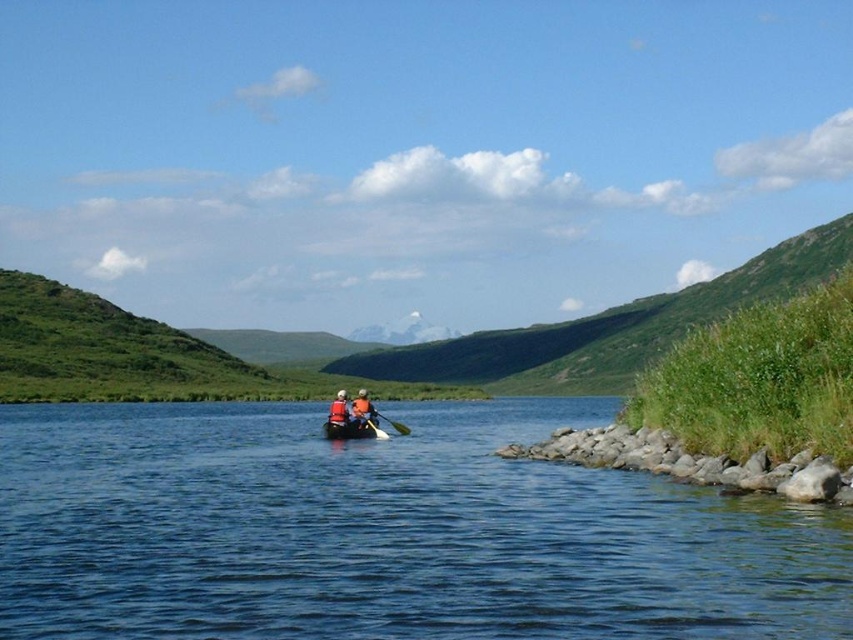
You are standing at the camera position and want to reach the point marked at coordinates point (360, 406). If you walk straight towards it, will you have to cross the water?

The point marked at coordinates point (360, 406) is 169.33 feet away from the camera position. Since the scene shows a calm body of water and the paddlers are in a canoe moving away from the viewer, it is likely that the point is on the water. Therefore, you would need to cross the water to reach it.

You are a photographer trying to capture a photo of the white plastic canoe at center and the orange life vest at center. Based on their positions, which object should you focus on first if you want to include both in your shot without moving the camera?

The white plastic canoe at center is to the left of orange life vest at center, so you should focus on the orange life vest at center first to ensure both are in frame without moving the camera.

You are standing at the edge of the water and want to throw a buoy to the two paddlers. The coordinates of the two points are point (560, 624) and point (370, 426). Which point should you aim for to reach the paddlers first?

Point (560, 624) is closer to the camera than point (370, 426), so you should aim for point (560, 624) to reach the paddlers first.